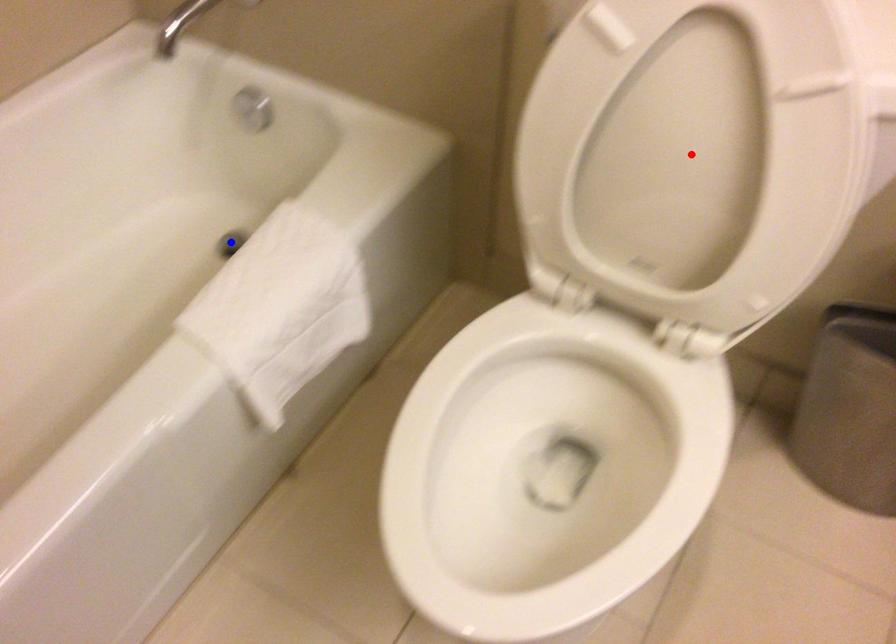
Question: Two points are marked on the image. Which point is closer to the camera?

Choices:
 (A) Blue point is closer.
 (B) Red point is closer.

Answer: (B)